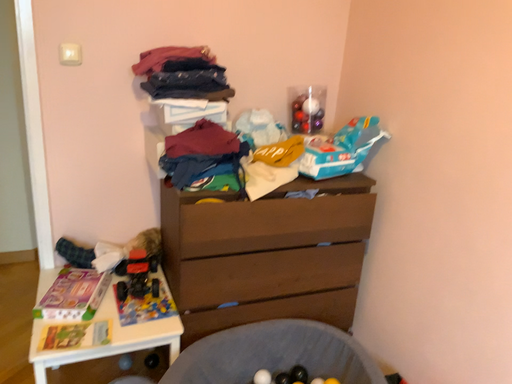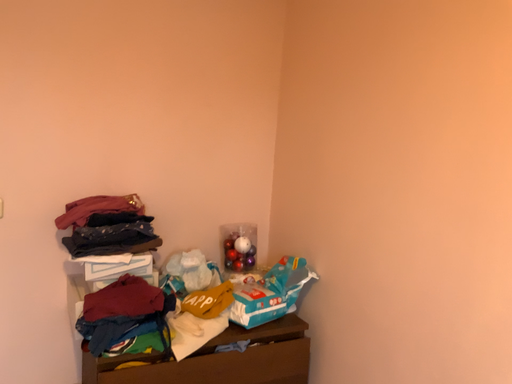
Question: Which way did the camera rotate in the video?

Choices:
 (A) rotated left
 (B) rotated right

Answer: (B)